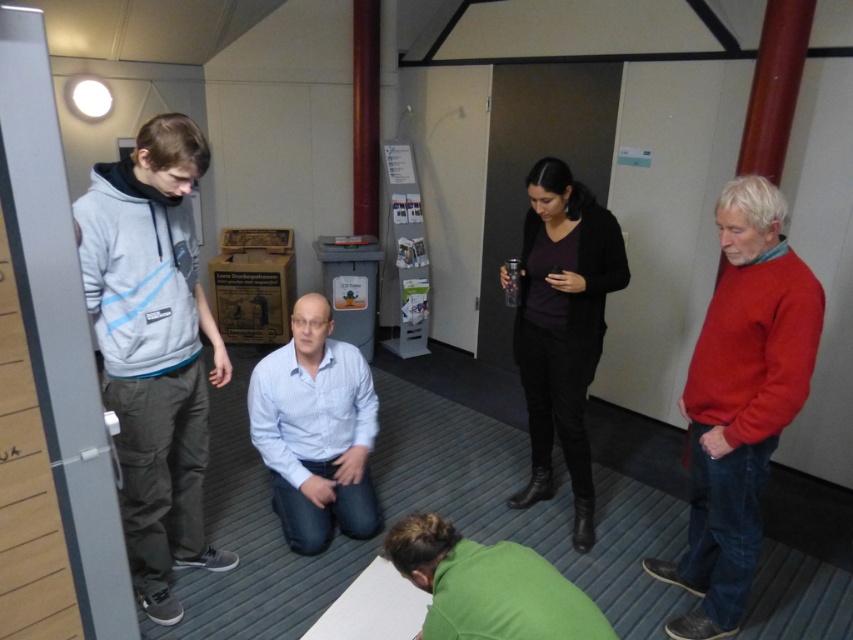
Who is more distant from viewer, (310, 481) or (555, 582)?

Point (310, 481)

Is light blue shirt at center taller than green matte shirt at lower center?

Indeed, light blue shirt at center has a greater height compared to green matte shirt at lower center.

What do you see at coordinates (315, 429) in the screenshot?
I see `light blue shirt at center` at bounding box center [315, 429].

The image size is (853, 640). Identify the location of light blue shirt at center. (315, 429).

Looking at this image, can you confirm if red sweater at right is positioned to the left of light blue shirt at center?

Incorrect, red sweater at right is not on the left side of light blue shirt at center.

You are a GUI agent. You are given a task and a screenshot of the screen. Output one action in this format:
    pyautogui.click(x=<x>, y=<y>)
    Task: Click on the red sweater at right
    
    Given the screenshot: What is the action you would take?
    pyautogui.click(x=740, y=401)

In order to click on red sweater at right in this screenshot , I will do `click(740, 401)`.

Which is behind, point (117, 374) or point (775, 305)?

The point (117, 374) is behind.

From the picture: Is the position of light gray hoodie at left less distant than that of red sweater at right?

That is True.

Measure the distance between light gray hoodie at left and camera.

light gray hoodie at left is 1.78 meters from camera.

Find the location of a particular element. This screenshot has height=640, width=853. light gray hoodie at left is located at coordinates (154, 349).